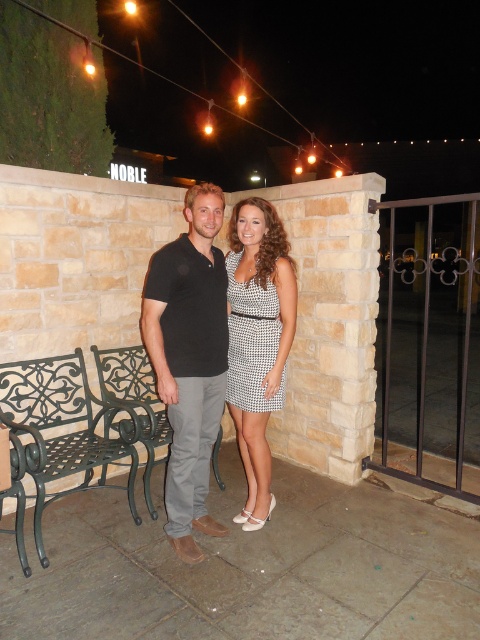
You are a photographer standing 10 feet away from the black cotton polo shirt at center. Can you take a clear photo of it without moving closer?

The photographer is 10 feet away from the black cotton polo shirt at center, but the description states they are 8.04 feet apart. Therefore, the photographer is actually closer than 10 feet and can take a clear photo without moving closer.

You are standing in front of the stone wall and want to place a small flowerpot exactly at the position of point (238, 420) and another flowerpot at point (243, 392). Which flowerpot will appear closer to you?

The flowerpot placed at point (238, 420) will appear closer to you because it is further to the viewer than point (243, 392) according to the description.